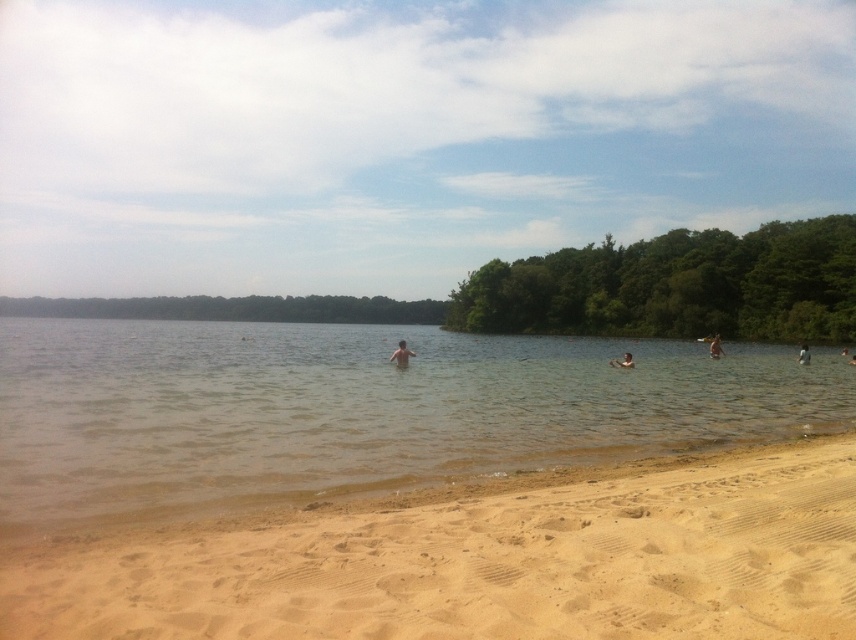
Question: Which object is positioned closest to the light brown skin at lower right?

Choices:
 (A) tan skin person at center
 (B) fine-grained sand at lower center
 (C) clear water at center

Answer: (A)

Question: Is clear water at center thinner than fine-grained sand at lower center?

Choices:
 (A) no
 (B) yes

Answer: (A)

Question: Does light brown skin at center appear on the left side of dark skin human at center?

Choices:
 (A) yes
 (B) no

Answer: (A)

Question: Which point appears farthest from the camera in this image?

Choices:
 (A) (403, 381)
 (B) (620, 358)

Answer: (B)

Question: Is clear water at center wider than brown skin at upper center?

Choices:
 (A) no
 (B) yes

Answer: (B)

Question: Which of the following is the closest to the observer?

Choices:
 (A) (197, 620)
 (B) (385, 413)
 (C) (798, 362)

Answer: (A)